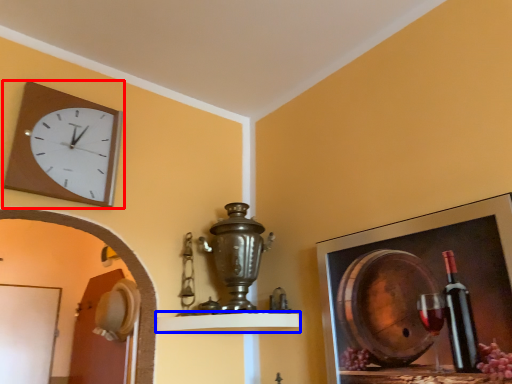
Question: Which object appears farthest to the camera in this image, wall clock (highlighted by a red box) or shelf (highlighted by a blue box)?

Choices:
 (A) wall clock
 (B) shelf

Answer: (B)